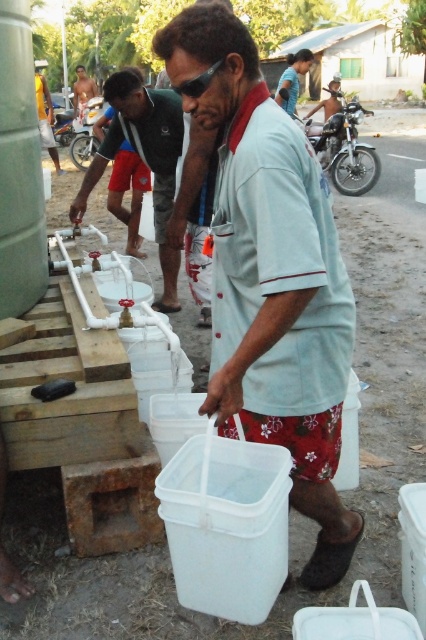
You are standing at the water distribution point and notice a man in a yellow shirt at center holding a white plastic bucket at center. Which object is positioned to the right of the other?

The white plastic bucket at center is to the right of the yellow shirt at center.